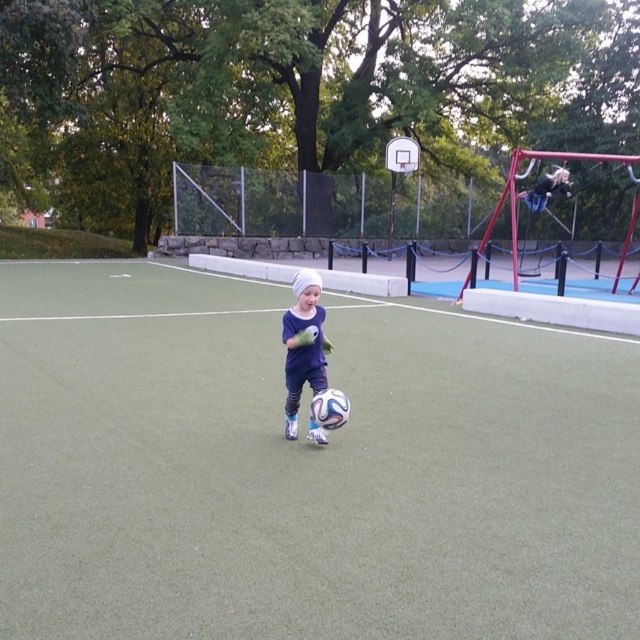
Question: Is green artificial turf at center above metallic silver basketball hoop at upper center?

Choices:
 (A) no
 (B) yes

Answer: (A)

Question: Is green artificial turf at center thinner than metallic silver basketball hoop at upper center?

Choices:
 (A) no
 (B) yes

Answer: (A)

Question: Does green artificial turf at center have a larger size compared to matte blue soccer ball at center?

Choices:
 (A) yes
 (B) no

Answer: (A)

Question: Estimate the real-world distances between objects in this image. Which object is closer to the matte blue soccer ball at center?

Choices:
 (A) green artificial turf at center
 (B) metallic silver basketball hoop at upper center

Answer: (A)

Question: Which point is farther to the camera?

Choices:
 (A) (316, 442)
 (B) (83, 609)
 (C) (392, 141)

Answer: (C)

Question: Which of the following is the closest to the observer?

Choices:
 (A) metallic silver basketball hoop at upper center
 (B) green artificial turf at center
 (C) matte blue soccer ball at center

Answer: (B)